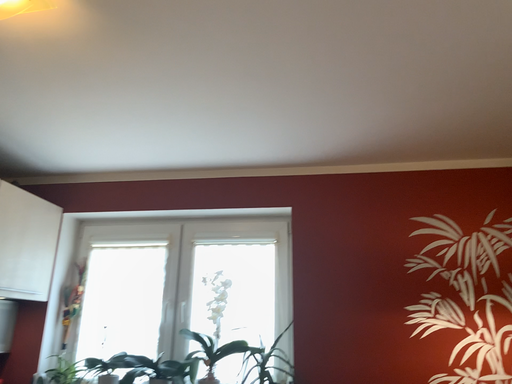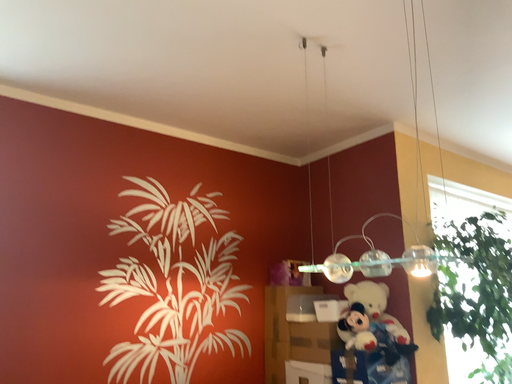
Question: How did the camera likely rotate when shooting the video?

Choices:
 (A) rotated upward
 (B) rotated downward

Answer: (B)